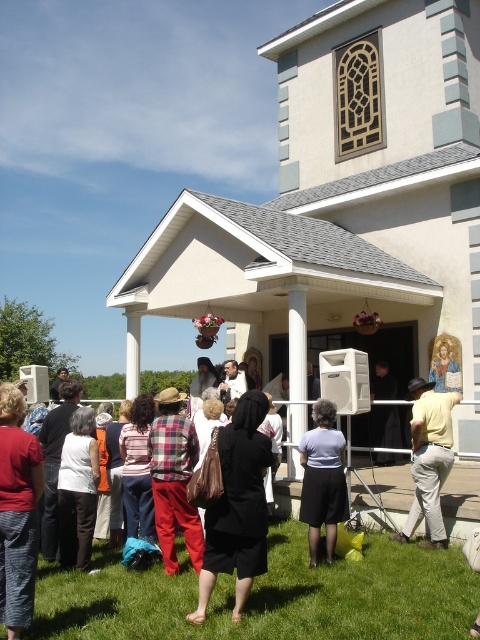
The width and height of the screenshot is (480, 640). I want to click on dark gray pants at lower left, so click(x=78, y=490).

Locate an element on the screen. The width and height of the screenshot is (480, 640). dark gray pants at lower left is located at coordinates (78, 490).

Is green grass at lower center behind yellow cotton shirt at center?

No, green grass at lower center is in front of yellow cotton shirt at center.

Between point (218, 580) and point (440, 456), which one is positioned behind?

The point (440, 456) is behind.

Is point (178, 604) in front of point (422, 461)?

That is True.

Find the location of `green grass at lower center`. green grass at lower center is located at coordinates tap(266, 596).

Does light purple fabric skirt at center have a lesser width compared to dark gray pants at lower left?

Yes.

Does light purple fabric skirt at center lie behind dark gray pants at lower left?

No.

Between point (328, 512) and point (94, 492), which one is positioned in front?

Point (328, 512) is in front.

You are a GUI agent. You are given a task and a screenshot of the screen. Output one action in this format:
    pyautogui.click(x=<x>, y=<y>)
    Task: Click on the light purple fabric skirt at center
    Image resolution: width=480 pixels, height=640 pixels.
    Given the screenshot: What is the action you would take?
    pyautogui.click(x=323, y=480)